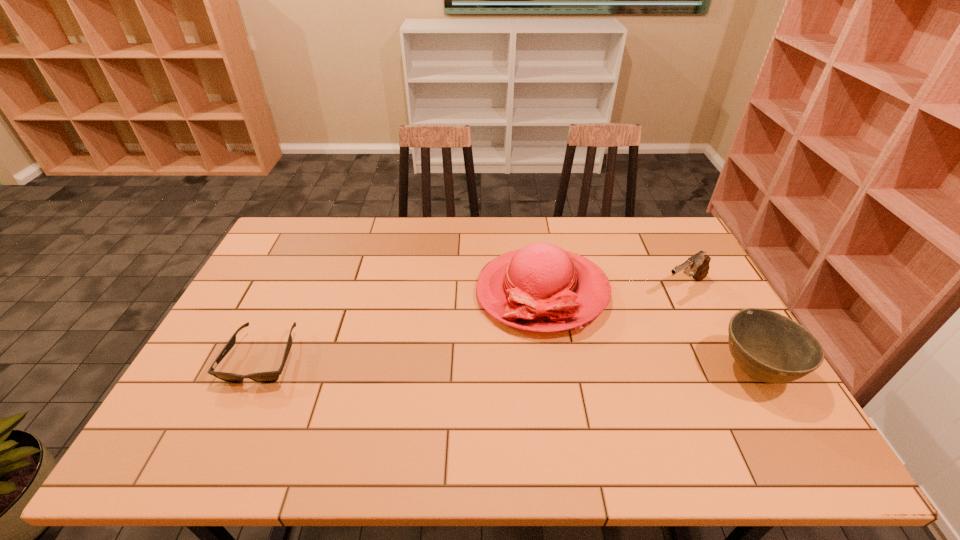
This screenshot has height=540, width=960. In order to click on unoccupied position between the second object from left to right and the bowl in this screenshot , I will do `click(648, 332)`.

Where is `vacant space that is in between the pistol and the bowl`? The height and width of the screenshot is (540, 960). vacant space that is in between the pistol and the bowl is located at coordinates [719, 329].

This screenshot has width=960, height=540. Identify the location of blank region between the hat and the leftmost object. (402, 325).

You are a GUI agent. You are given a task and a screenshot of the screen. Output one action in this format:
    pyautogui.click(x=<x>, y=<y>)
    Task: Click on the free space between the pistol and the tallest object
    
    Given the screenshot: What is the action you would take?
    pyautogui.click(x=612, y=289)

Find the location of a particular element. vacant space in between the bowl and the sunglasses is located at coordinates (509, 364).

Where is `vacant space in between the bowl and the hat`? vacant space in between the bowl and the hat is located at coordinates (648, 332).

Locate an element on the screen. This screenshot has height=540, width=960. vacant point located between the second object from left to right and the pistol is located at coordinates (612, 289).

Image resolution: width=960 pixels, height=540 pixels. Find the location of `object that stands as the third closest to the bowl`. object that stands as the third closest to the bowl is located at coordinates (263, 377).

Locate an element on the screen. This screenshot has width=960, height=540. object that is the second closest to the pistol is located at coordinates (769, 347).

At what (x,y) coordinates should I click in order to perform the action: click on vacant position in the image that satisfies the following two spatial constraints: 1. on the front side of the tallest object; 2. on the left side of the bowl. Please return your answer as a coordinate pair (x, y). Looking at the image, I should click on (554, 372).